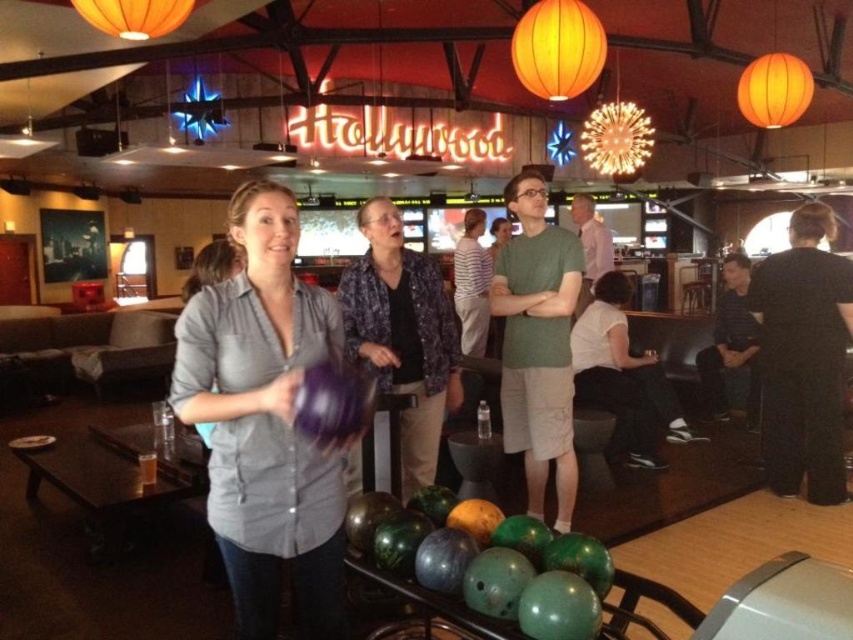
You are a customer at the Hollywood themed bowling alley and you see two shirts at the center. The matte gray shirt at center and the purple floral shirt at center. Which shirt is positioned to the left?

The matte gray shirt at center is to the left of the purple floral shirt at center.

You are trying to decide which shirt to wear for a casual day out. Both the matte gray shirt at center and the purple floral shirt at center are options. Based on the image, which one is larger in size?

The matte gray shirt at center is bigger than the purple floral shirt at center, so the matte gray shirt at center is the larger option.